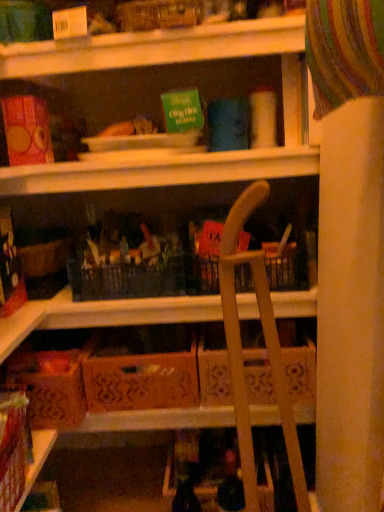
In order to face orange cardboard box at center, which is counted as the 2th cardboard box, starting from the left, should I rotate leftwards or rightwards?

Rotate your view left by about 5.408°.

You are a GUI agent. You are given a task and a screenshot of the screen. Output one action in this format:
    pyautogui.click(x=<x>, y=<y>)
    Task: Click on the wooden folding chair at center
    
    Given the screenshot: What is the action you would take?
    pyautogui.click(x=266, y=347)

Is wooden folding chair at center taller than orange cardboard box at center, which is counted as the 2th cardboard box, starting from the left?

Yes, wooden folding chair at center is taller than orange cardboard box at center, which is counted as the 2th cardboard box, starting from the left.

Could you tell me if wooden folding chair at center is turned towards orange cardboard box at center, marked as the 1th cardboard box in a right-to-left arrangement?

No, wooden folding chair at center is not aimed at orange cardboard box at center, marked as the 1th cardboard box in a right-to-left arrangement.

From the image's perspective, is wooden folding chair at center positioned above or below orange cardboard box at center, marked as the 1th cardboard box in a right-to-left arrangement?

wooden folding chair at center is situated lower than orange cardboard box at center, marked as the 1th cardboard box in a right-to-left arrangement, in the image.

Is wooden folding chair at center at the right side of orange cardboard box at center, marked as the 1th cardboard box in a right-to-left arrangement?

Yes, wooden folding chair at center is to the right of orange cardboard box at center, marked as the 1th cardboard box in a right-to-left arrangement.

Between wooden folding chair at center and brown cardboard box at lower left, which is counted as the 1th cardboard box, starting from the left, which one has less height?

brown cardboard box at lower left, which is counted as the 1th cardboard box, starting from the left, is shorter.

The height and width of the screenshot is (512, 384). In order to click on folding chair lying on the right of brown cardboard box at lower left, the 2th cardboard box when ordered from right to left in this screenshot , I will do `click(266, 347)`.

From the image's perspective, is wooden folding chair at center above brown cardboard box at lower left, which is counted as the 1th cardboard box, starting from the left?

Correct, wooden folding chair at center appears higher than brown cardboard box at lower left, which is counted as the 1th cardboard box, starting from the left, in the image.

Is wooden folding chair at center next to brown cardboard box at lower left, which is counted as the 1th cardboard box, starting from the left, and touching it?

There is a gap between wooden folding chair at center and brown cardboard box at lower left, which is counted as the 1th cardboard box, starting from the left.

Is orange cardboard box at center, marked as the 1th cardboard box in a right-to-left arrangement, taller than wooden folding chair at center?

No.

Are orange cardboard box at center, marked as the 1th cardboard box in a right-to-left arrangement, and wooden folding chair at center beside each other?

orange cardboard box at center, marked as the 1th cardboard box in a right-to-left arrangement, and wooden folding chair at center are clearly separated.

Is orange cardboard box at center, marked as the 1th cardboard box in a right-to-left arrangement, looking in the opposite direction of wooden folding chair at center?

No, orange cardboard box at center, marked as the 1th cardboard box in a right-to-left arrangement,'s orientation is not away from wooden folding chair at center.

Is the position of brown cardboard box at lower left, which is counted as the 1th cardboard box, starting from the left, more distant than that of orange cardboard box at center, marked as the 1th cardboard box in a right-to-left arrangement?

That is False.

You are a GUI agent. You are given a task and a screenshot of the screen. Output one action in this format:
    pyautogui.click(x=<x>, y=<y>)
    Task: Click on the cardboard box above the brown cardboard box at lower left, the 2th cardboard box when ordered from right to left (from the image's perspective)
    
    Given the screenshot: What is the action you would take?
    pyautogui.click(x=141, y=381)

Considering the relative sizes of brown cardboard box at lower left, the 2th cardboard box when ordered from right to left, and orange cardboard box at center, marked as the 1th cardboard box in a right-to-left arrangement, in the image provided, is brown cardboard box at lower left, the 2th cardboard box when ordered from right to left, taller than orange cardboard box at center, marked as the 1th cardboard box in a right-to-left arrangement,?

Correct, brown cardboard box at lower left, the 2th cardboard box when ordered from right to left, is much taller as orange cardboard box at center, marked as the 1th cardboard box in a right-to-left arrangement.

Considering the sizes of brown cardboard box at lower left, the 2th cardboard box when ordered from right to left, and orange cardboard box at center, marked as the 1th cardboard box in a right-to-left arrangement, in the image, is brown cardboard box at lower left, the 2th cardboard box when ordered from right to left, wider or thinner than orange cardboard box at center, marked as the 1th cardboard box in a right-to-left arrangement,?

Clearly, brown cardboard box at lower left, the 2th cardboard box when ordered from right to left, has less width compared to orange cardboard box at center, marked as the 1th cardboard box in a right-to-left arrangement.

Does point (115, 404) appear closer or farther from the camera than point (83, 384)?

Clearly, point (115, 404) is more distant from the camera than point (83, 384).

How different are the orientations of orange cardboard box at center, marked as the 1th cardboard box in a right-to-left arrangement, and brown cardboard box at lower left, the 2th cardboard box when ordered from right to left, in degrees?

There is a 2.27-degree angle between the facing directions of orange cardboard box at center, marked as the 1th cardboard box in a right-to-left arrangement, and brown cardboard box at lower left, the 2th cardboard box when ordered from right to left.

Which of these two, orange cardboard box at center, which is counted as the 2th cardboard box, starting from the left, or brown cardboard box at lower left, which is counted as the 1th cardboard box, starting from the left, is smaller?

brown cardboard box at lower left, which is counted as the 1th cardboard box, starting from the left.

From the image's perspective, does orange cardboard box at center, marked as the 1th cardboard box in a right-to-left arrangement, appear higher than brown cardboard box at lower left, the 2th cardboard box when ordered from right to left?

Yes, from the image's perspective, orange cardboard box at center, marked as the 1th cardboard box in a right-to-left arrangement, is over brown cardboard box at lower left, the 2th cardboard box when ordered from right to left.

At what (x,y) coordinates should I click in order to perform the action: click on the 1st cardboard box behind when counting from the wooden folding chair at center. Please return your answer as a coordinate pair (x, y). Looking at the image, I should click on (50, 387).

From a real-world perspective, which is physically below, brown cardboard box at lower left, the 2th cardboard box when ordered from right to left, or wooden folding chair at center?

In real-world perspective, brown cardboard box at lower left, the 2th cardboard box when ordered from right to left, is lower.

Based on the photo, can you confirm if brown cardboard box at lower left, which is counted as the 1th cardboard box, starting from the left, is wider than wooden folding chair at center?

No.

Can you tell me how much brown cardboard box at lower left, which is counted as the 1th cardboard box, starting from the left, and wooden folding chair at center differ in facing direction?

84.4 degrees.

This screenshot has height=512, width=384. I want to click on the 1st cardboard box to the left of the wooden folding chair at center, starting your count from the anchor, so click(141, 381).

Locate an element on the screen. The image size is (384, 512). the 1st cardboard box directly beneath the wooden folding chair at center (from a real-world perspective) is located at coordinates (50, 387).

From the image, which object appears to be farther from orange cardboard box at center, marked as the 1th cardboard box in a right-to-left arrangement, wooden folding chair at center or brown cardboard box at lower left, the 2th cardboard box when ordered from right to left?

The object further to orange cardboard box at center, marked as the 1th cardboard box in a right-to-left arrangement, is wooden folding chair at center.

Based on their spatial positions, is brown cardboard box at lower left, the 2th cardboard box when ordered from right to left, or wooden folding chair at center further from orange cardboard box at center, which is counted as the 2th cardboard box, starting from the left?

wooden folding chair at center.

When comparing their distances from wooden folding chair at center, does orange cardboard box at center, which is counted as the 2th cardboard box, starting from the left, or brown cardboard box at lower left, the 2th cardboard box when ordered from right to left, seem closer?

orange cardboard box at center, which is counted as the 2th cardboard box, starting from the left, is closer to wooden folding chair at center.

Based on the photo, considering their positions, is brown cardboard box at lower left, which is counted as the 1th cardboard box, starting from the left, positioned further to wooden folding chair at center than orange cardboard box at center, marked as the 1th cardboard box in a right-to-left arrangement?

The object further to wooden folding chair at center is brown cardboard box at lower left, which is counted as the 1th cardboard box, starting from the left.

When comparing their distances from brown cardboard box at lower left, which is counted as the 1th cardboard box, starting from the left, does wooden folding chair at center or orange cardboard box at center, which is counted as the 2th cardboard box, starting from the left, seem closer?

orange cardboard box at center, which is counted as the 2th cardboard box, starting from the left.

Looking at the image, which one is located closer to brown cardboard box at lower left, which is counted as the 1th cardboard box, starting from the left, orange cardboard box at center, marked as the 1th cardboard box in a right-to-left arrangement, or wooden folding chair at center?

orange cardboard box at center, marked as the 1th cardboard box in a right-to-left arrangement, is positioned closer to the anchor brown cardboard box at lower left, which is counted as the 1th cardboard box, starting from the left.

The image size is (384, 512). In order to click on cardboard box located between brown cardboard box at lower left, the 2th cardboard box when ordered from right to left, and wooden folding chair at center in the left-right direction in this screenshot , I will do `click(141, 381)`.